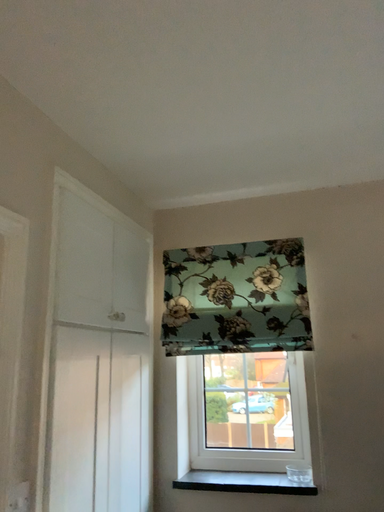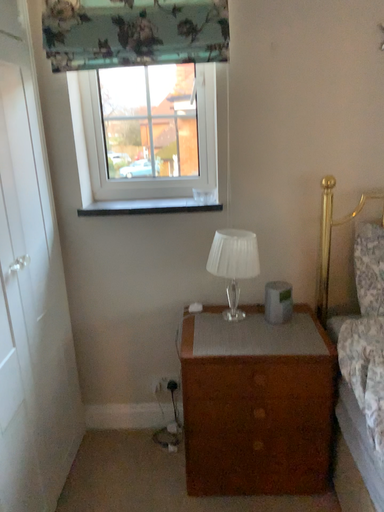
Question: How did the camera likely rotate when shooting the video?

Choices:
 (A) rotated downward
 (B) rotated upward

Answer: (A)